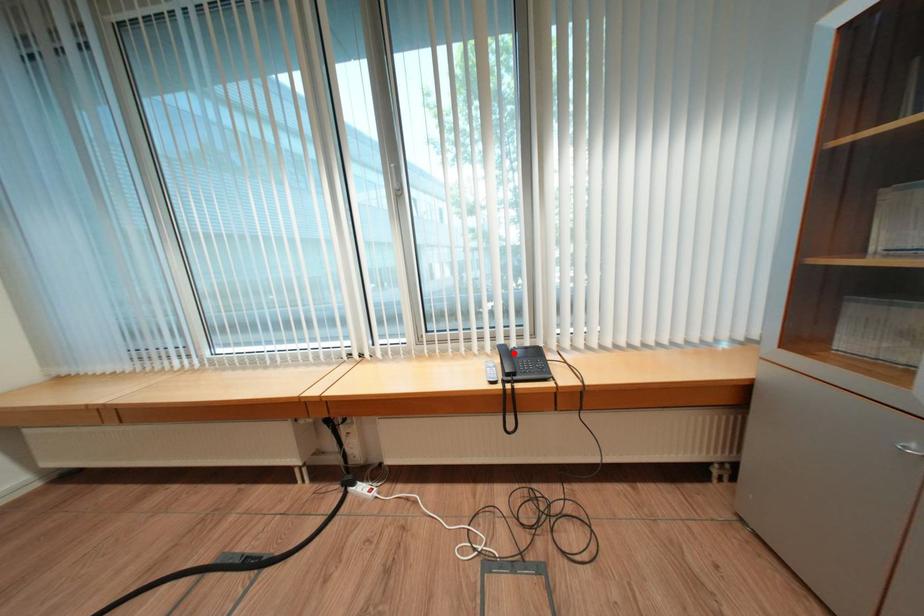
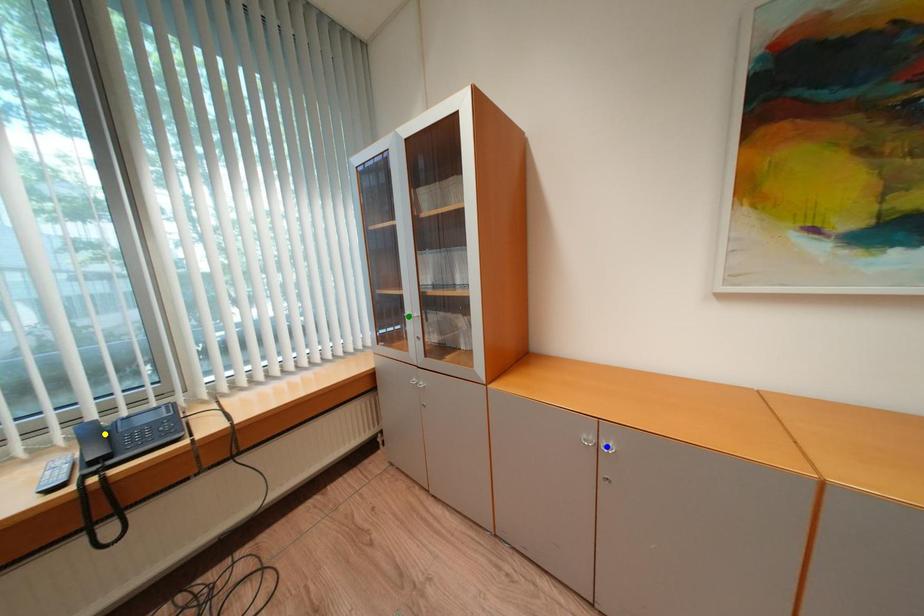
Question: I am providing you with two images of the same scene from different viewpoints. A red point is marked on the first image. You are given multiple points on the second image. Which mark in image 2 goes with the point in image 1?

Choices:
 (A) green point
 (B) yellow point
 (C) blue point

Answer: (B)